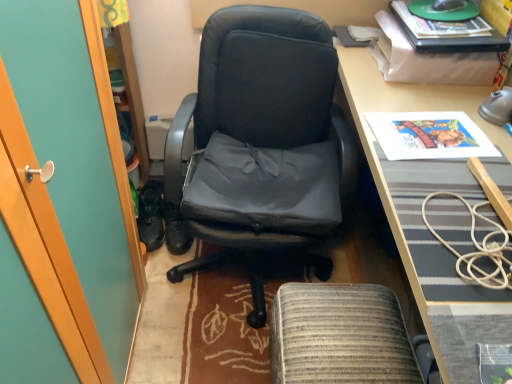
Question: From a real-world perspective, is woven fabric footrest at lower center on black plastic mouse at upper right?

Choices:
 (A) yes
 (B) no

Answer: (B)

Question: From a real-world perspective, is woven fabric footrest at lower center under black plastic mouse at upper right?

Choices:
 (A) yes
 (B) no

Answer: (A)

Question: Can you confirm if woven fabric footrest at lower center is positioned to the right of black plastic mouse at upper right?

Choices:
 (A) yes
 (B) no

Answer: (B)

Question: Does woven fabric footrest at lower center have a lesser height compared to black plastic mouse at upper right?

Choices:
 (A) yes
 (B) no

Answer: (B)

Question: Is woven fabric footrest at lower center at the left side of black plastic mouse at upper right?

Choices:
 (A) no
 (B) yes

Answer: (B)

Question: Based on their positions, is black plastic mouse at upper right located to the left or right of woven fabric footrest at lower center?

Choices:
 (A) left
 (B) right

Answer: (B)

Question: Looking at their shapes, would you say black plastic mouse at upper right is wider or thinner than woven fabric footrest at lower center?

Choices:
 (A) thin
 (B) wide

Answer: (A)

Question: From a real-world perspective, relative to woven fabric footrest at lower center, is black plastic mouse at upper right vertically above or below?

Choices:
 (A) below
 (B) above

Answer: (B)

Question: Is black plastic mouse at upper right spatially inside woven fabric footrest at lower center, or outside of it?

Choices:
 (A) inside
 (B) outside

Answer: (B)

Question: Based on their positions, is black leather shoes at lower left located to the left or right of woven fabric footrest at lower center?

Choices:
 (A) left
 (B) right

Answer: (A)

Question: Considering their positions, is black leather shoes at lower left located in front of or behind woven fabric footrest at lower center?

Choices:
 (A) front
 (B) behind

Answer: (B)

Question: From their relative heights in the image, would you say black leather shoes at lower left is taller or shorter than woven fabric footrest at lower center?

Choices:
 (A) tall
 (B) short

Answer: (B)

Question: Would you say black leather shoes at lower left is inside or outside woven fabric footrest at lower center?

Choices:
 (A) inside
 (B) outside

Answer: (B)

Question: Would you say wooden desk at center is to the left or to the right of black leather chair at center in the picture?

Choices:
 (A) left
 (B) right

Answer: (B)

Question: Considering the positions of wooden desk at center and black leather chair at center in the image, is wooden desk at center wider or thinner than black leather chair at center?

Choices:
 (A) thin
 (B) wide

Answer: (A)